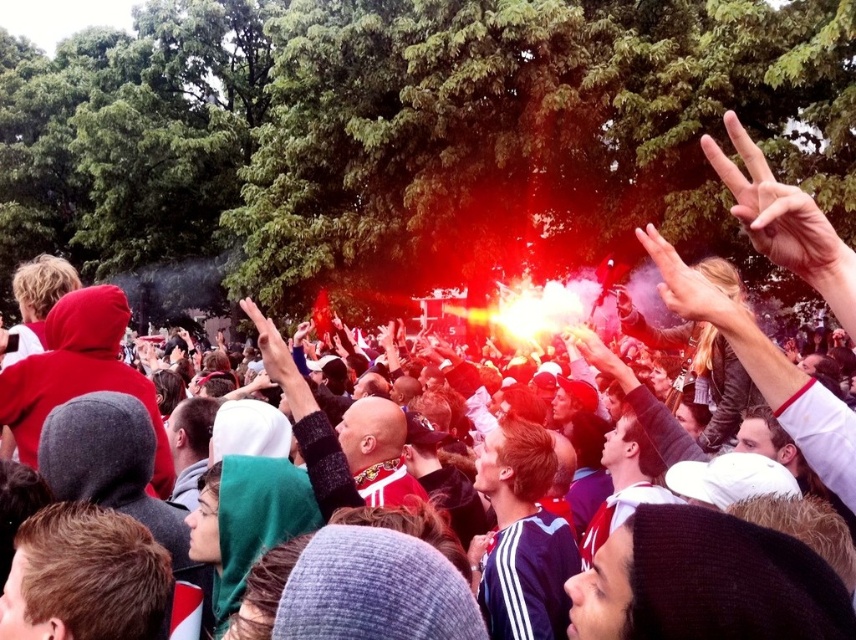
Is skinny white hand at upper right in front of smooth skin hand at upper right?

Yes.

Is skinny white hand at upper right wider than smooth skin hand at upper right?

Correct, the width of skinny white hand at upper right exceeds that of smooth skin hand at upper right.

At what (x,y) coordinates should I click in order to perform the action: click on skinny white hand at upper right. Please return your answer as a coordinate pair (x, y). This screenshot has height=640, width=856. Looking at the image, I should click on (782, 218).

At what (x,y) coordinates should I click in order to perform the action: click on skinny white hand at upper right. Please return your answer as a coordinate pair (x, y). Looking at the image, I should click on (782, 218).